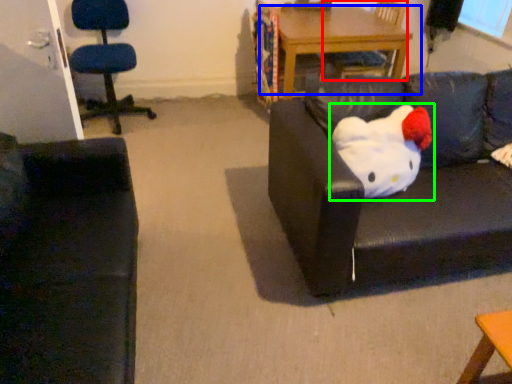
Question: Which is nearer to the chair (highlighted by a red box)? table (highlighted by a blue box) or toy (highlighted by a green box).

Choices:
 (A) table
 (B) toy

Answer: (A)